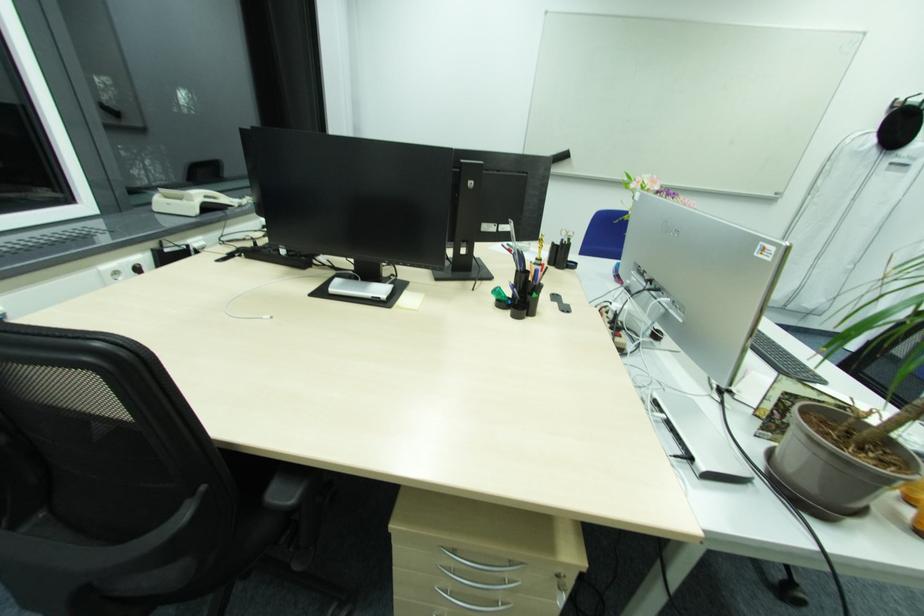
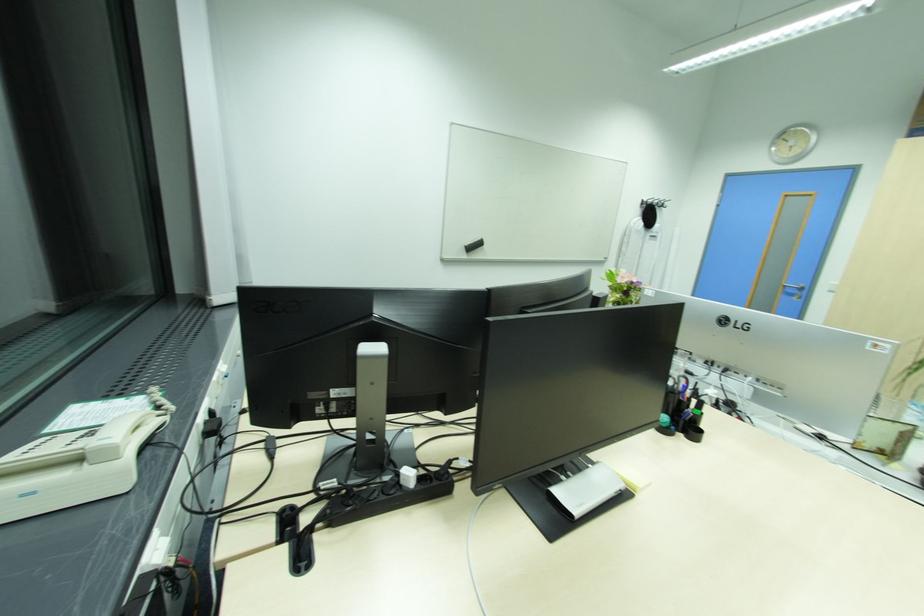
Locate, in the second image, the point that corresponds to (x=174, y=205) in the first image.

(30, 493)